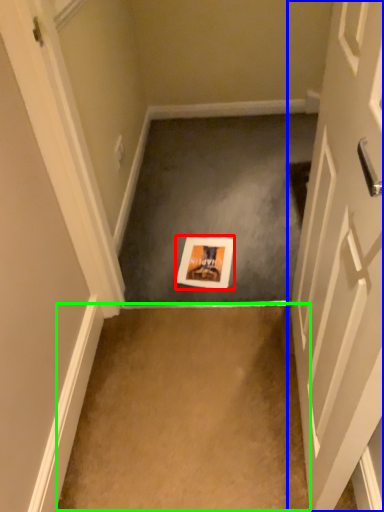
Question: Considering the real-world distances, which object is farthest from postcard (highlighted by a red box)? door (highlighted by a blue box) or concrete (highlighted by a green box)?

Choices:
 (A) door
 (B) concrete

Answer: (A)